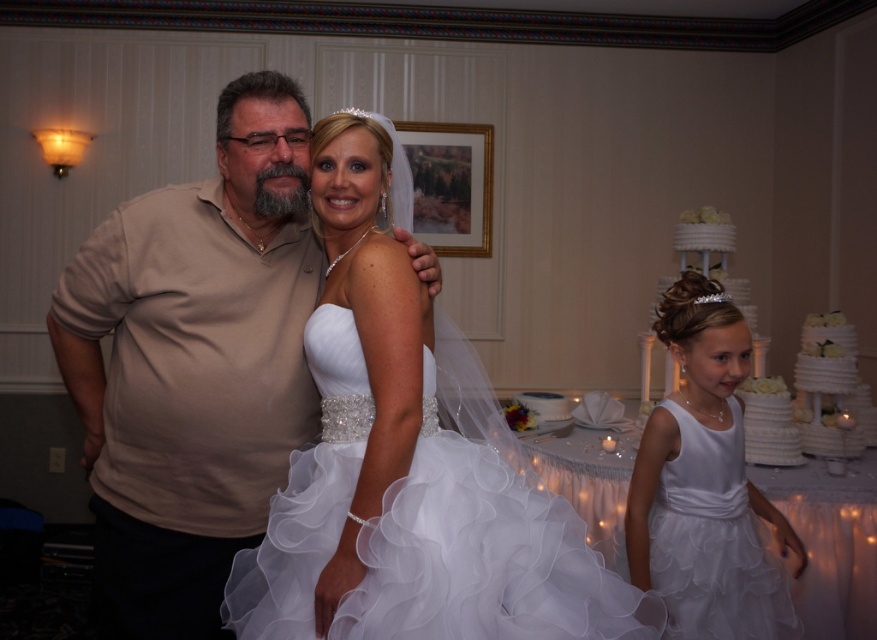
Describe the element at coordinates (408, 461) in the screenshot. I see `white satin dress at center` at that location.

Can you confirm if white satin dress at center is positioned to the right of beige cotton shirt at center?

Yes, white satin dress at center is to the right of beige cotton shirt at center.

Who is more forward, (389, 624) or (175, 506)?

Point (389, 624) is more forward.

Where is `white satin dress at center`? The image size is (877, 640). white satin dress at center is located at coordinates (408, 461).

Is point (186, 273) positioned in front of point (761, 582)?

Yes.

Between beige cotton shirt at center and white satin dress at right, which one is positioned lower?

white satin dress at right

You are a GUI agent. You are given a task and a screenshot of the screen. Output one action in this format:
    pyautogui.click(x=<x>, y=<y>)
    Task: Click on the beige cotton shirt at center
    
    Given the screenshot: What is the action you would take?
    pyautogui.click(x=194, y=364)

You are a GUI agent. You are given a task and a screenshot of the screen. Output one action in this format:
    pyautogui.click(x=<x>, y=<y>)
    Task: Click on the beige cotton shirt at center
    
    Given the screenshot: What is the action you would take?
    pyautogui.click(x=194, y=364)

Between white satin dress at center and white textured cake at right, which one has more height?

white satin dress at center

Which of these two, white satin dress at center or white textured cake at right, stands shorter?

Standing shorter between the two is white textured cake at right.

Identify the location of white satin dress at center. The image size is (877, 640). (408, 461).